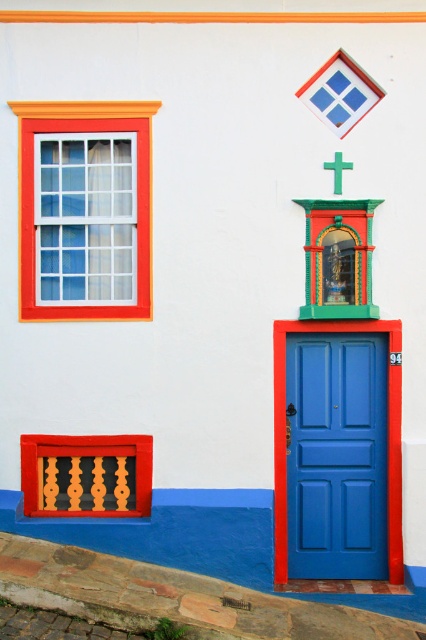
Looking at this image, you are standing in front of the building and notice the orange matte window at upper left. Where exactly is this window positioned relative to the other elements on the facade?

The orange matte window at upper left is located at point (137, 195) on the facade.

You are an architect designing a new building and want to ensure proper proportions between the blue glossy door at right and the green matte cross at upper center. Based on the image, which object should be placed higher in your design?

The blue glossy door at right is taller than the green matte cross at upper center, so in the design, the blue glossy door at right should be placed higher to maintain proportionality.